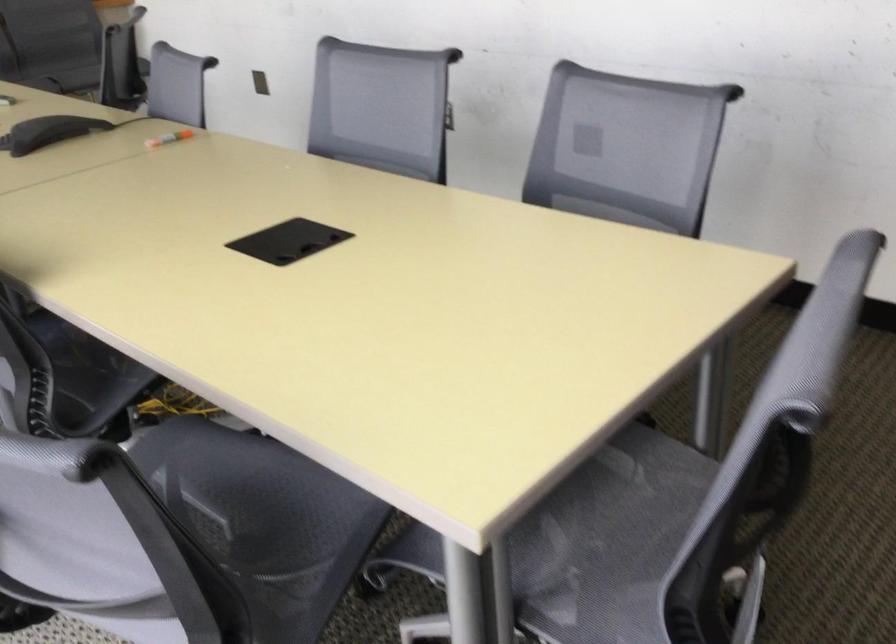
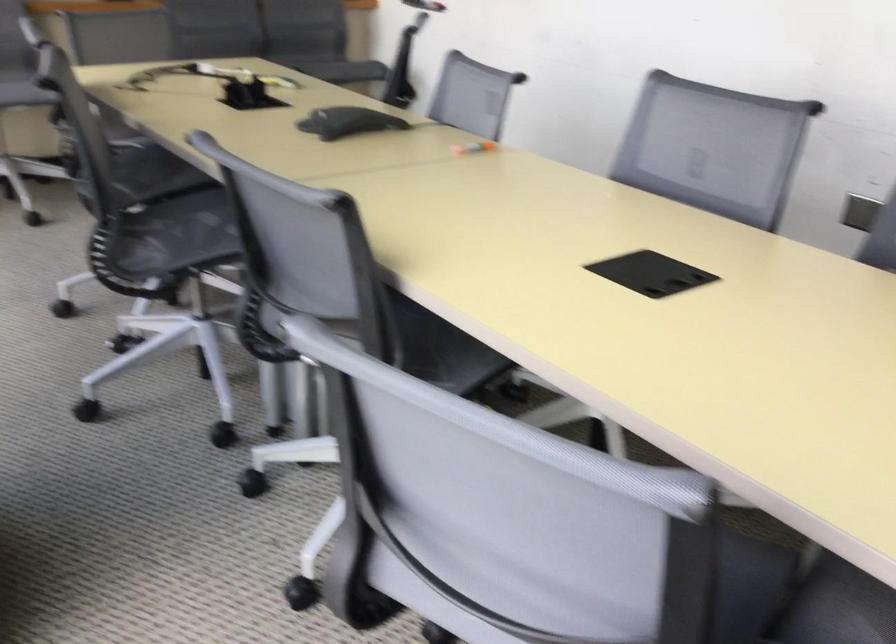
Question: What movement of the cameraman would produce the second image?

Choices:
 (A) Left
 (B) Right
 (C) Forward
 (D) Backward

Answer: (A)